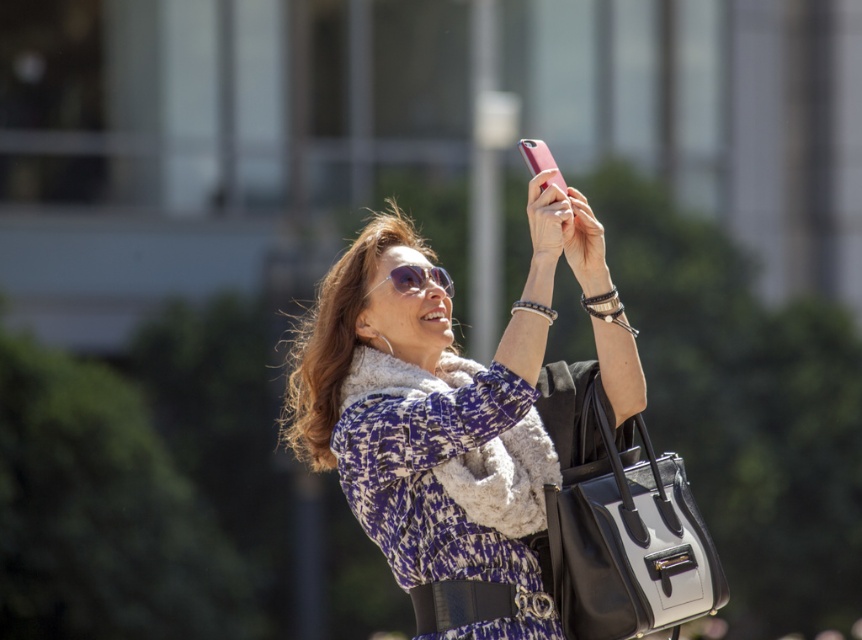
Question: Is matte black jacket at center positioned behind black leather handbag at lower right?

Choices:
 (A) yes
 (B) no

Answer: (A)

Question: Is black leather handbag at lower right bigger than shiny silver sunglasses at center?

Choices:
 (A) no
 (B) yes

Answer: (B)

Question: Is matte black jacket at center in front of black leather handbag at lower right?

Choices:
 (A) yes
 (B) no

Answer: (B)

Question: Which object is positioned closest to the black leather handbag at lower right?

Choices:
 (A) matte black jacket at center
 (B) shiny silver sunglasses at center

Answer: (A)

Question: Among these points, which one is farthest from the camera?

Choices:
 (A) (292, 380)
 (B) (681, 520)
 (C) (423, 266)

Answer: (A)

Question: Among these points, which one is nearest to the camera?

Choices:
 (A) (411, 285)
 (B) (554, 456)

Answer: (B)